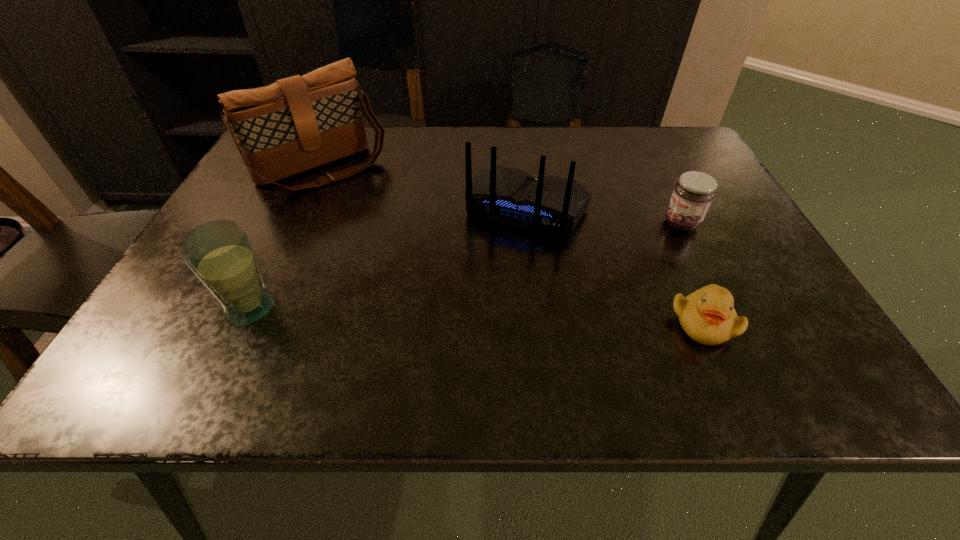
This screenshot has height=540, width=960. I want to click on vacant region located 0.230m on the front-facing side of the tallest object, so click(402, 242).

Locate an element on the screen. vacant space located on the front-facing side of the tallest object is located at coordinates (410, 251).

What are the coordinates of `free space located 0.180m on the back of the third object from right to left` in the screenshot? It's located at (480, 301).

Locate an element on the screen. vacant space located 0.160m on the back of the third object from right to left is located at coordinates (484, 294).

You are a GUI agent. You are given a task and a screenshot of the screen. Output one action in this format:
    pyautogui.click(x=<x>, y=<y>)
    Task: Click on the free space located on the back of the third object from right to left
    Image resolution: width=960 pixels, height=540 pixels.
    Given the screenshot: What is the action you would take?
    pyautogui.click(x=474, y=313)

Where is `object present at the far edge`? object present at the far edge is located at coordinates 296,124.

I want to click on glass present at the near edge, so (220, 253).

Image resolution: width=960 pixels, height=540 pixels. In order to click on duckling at the near edge in this screenshot , I will do `click(707, 316)`.

Locate an element on the screen. The width and height of the screenshot is (960, 540). glass located in the left edge section of the desktop is located at coordinates (220, 253).

Locate an element on the screen. The image size is (960, 540). shoulder bag located at the left edge is located at coordinates (296, 124).